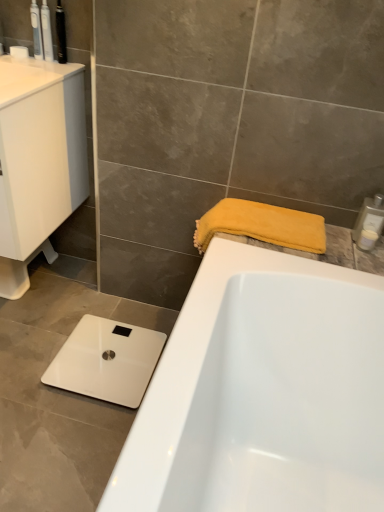
The width and height of the screenshot is (384, 512). Find the location of `vacant area that is in front of metallic black toothbrush at upper left, acting as the 3th toiletry starting from the right`. vacant area that is in front of metallic black toothbrush at upper left, acting as the 3th toiletry starting from the right is located at coordinates (54, 70).